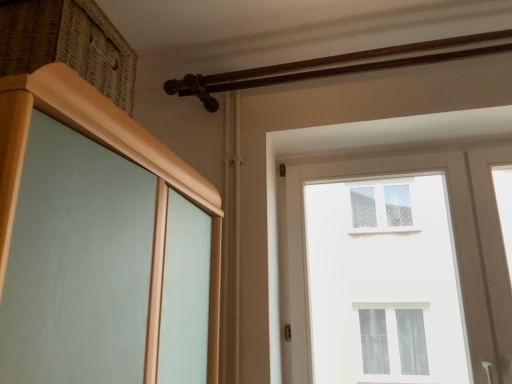
Identify the location of woven wood drawer at upper left. This screenshot has width=512, height=384. (68, 44).

In order to face white glass window at upper center, should I rotate leftwards or rightwards?

To face it directly, rotate right by 20.895 degrees.

Find the location of a particular element. This screenshot has height=384, width=512. woven wood drawer at upper left is located at coordinates (68, 44).

Can you confirm if white glass window at upper center is positioned to the left of woven wood drawer at upper left?

No, white glass window at upper center is not to the left of woven wood drawer at upper left.

From a real-world perspective, relative to woven wood drawer at upper left, is white glass window at upper center vertically above or below?

Clearly, from a real-world perspective, white glass window at upper center is below woven wood drawer at upper left.

Is point (370, 187) positioned in front of point (103, 63)?

No, (370, 187) is behind (103, 63).

Is white glass window at upper center wider or thinner than woven wood drawer at upper left?

Considering their sizes, white glass window at upper center looks slimmer than woven wood drawer at upper left.

How distant is woven wood drawer at upper left from white glass window at upper center?

woven wood drawer at upper left and white glass window at upper center are 2.77 meters apart.

Is point (46, 33) more distant than point (353, 260)?

That is False.

Is woven wood drawer at upper left completely or partially outside of white glass window at upper center?

Absolutely, woven wood drawer at upper left is external to white glass window at upper center.

Which of these two, woven wood drawer at upper left or white glass window at upper center, stands taller?

white glass window at upper center.

Are woven wood drawer at upper left and brown wooden rail at upper center beside each other?

No, woven wood drawer at upper left is not next to brown wooden rail at upper center.

From the image's perspective, is woven wood drawer at upper left located above or below brown wooden rail at upper center?

Based on their image positions, woven wood drawer at upper left is located beneath brown wooden rail at upper center.

Is the position of woven wood drawer at upper left less distant than that of brown wooden rail at upper center?

Yes, woven wood drawer at upper left is closer to the camera.

Which is correct: woven wood drawer at upper left is inside brown wooden rail at upper center, or outside of it?

woven wood drawer at upper left cannot be found inside brown wooden rail at upper center.

Measure the distance from white glass window at upper center to brown wooden rail at upper center.

7.31 feet.

From the image's perspective, which is above, white glass window at upper center or brown wooden rail at upper center?

From the image's view, brown wooden rail at upper center is above.

Would you say white glass window at upper center is outside brown wooden rail at upper center?

Yes, white glass window at upper center is located beyond the bounds of brown wooden rail at upper center.

You are a GUI agent. You are given a task and a screenshot of the screen. Output one action in this format:
    pyautogui.click(x=<x>, y=<y>)
    Task: Click on the window that appears on the right of brown wooden rail at upper center
    The width and height of the screenshot is (512, 384).
    Given the screenshot: What is the action you would take?
    pyautogui.click(x=399, y=270)

Is brown wooden rail at upper center far from woven wood drawer at upper left?

brown wooden rail at upper center is actually quite close to woven wood drawer at upper left.

Is brown wooden rail at upper center facing away from woven wood drawer at upper left?

brown wooden rail at upper center is not turned away from woven wood drawer at upper left.

Is brown wooden rail at upper center to the left of woven wood drawer at upper left from the viewer's perspective?

No, brown wooden rail at upper center is not to the left of woven wood drawer at upper left.

Which of these two, brown wooden rail at upper center or woven wood drawer at upper left, stands taller?

Standing taller between the two is woven wood drawer at upper left.

Considering the relative sizes of brown wooden rail at upper center and white glass window at upper center in the image provided, is brown wooden rail at upper center smaller than white glass window at upper center?

No.

Is brown wooden rail at upper center facing towards white glass window at upper center?

No, brown wooden rail at upper center does not turn towards white glass window at upper center.

Does brown wooden rail at upper center have a greater width compared to white glass window at upper center?

Correct, the width of brown wooden rail at upper center exceeds that of white glass window at upper center.

Considering the sizes of brown wooden rail at upper center and white glass window at upper center in the image, is brown wooden rail at upper center taller or shorter than white glass window at upper center?

In the image, brown wooden rail at upper center appears to be shorter than white glass window at upper center.

Identify the location of drawer that is above the white glass window at upper center (from a real-world perspective). (68, 44).

Where is `drawer above the white glass window at upper center (from the image's perspective)`? This screenshot has width=512, height=384. drawer above the white glass window at upper center (from the image's perspective) is located at coordinates (68, 44).

From the picture: From the image, which object appears to be nearer to woven wood drawer at upper left, brown wooden rail at upper center or white glass window at upper center?

brown wooden rail at upper center.

When comparing their distances from brown wooden rail at upper center, does white glass window at upper center or woven wood drawer at upper left seem closer?

Among the two, woven wood drawer at upper left is located nearer to brown wooden rail at upper center.

When comparing their distances from white glass window at upper center, does woven wood drawer at upper left or brown wooden rail at upper center seem further?

woven wood drawer at upper left is positioned further to the anchor white glass window at upper center.

Based on their spatial positions, is brown wooden rail at upper center or woven wood drawer at upper left closer to white glass window at upper center?

brown wooden rail at upper center is positioned closer to the anchor white glass window at upper center.

From the image, which object appears to be farther from woven wood drawer at upper left, white glass window at upper center or brown wooden rail at upper center?

white glass window at upper center is further to woven wood drawer at upper left.

Which object lies further to the anchor point brown wooden rail at upper center, woven wood drawer at upper left or white glass window at upper center?

white glass window at upper center is positioned further to the anchor brown wooden rail at upper center.

At what (x,y) coordinates should I click in order to perform the action: click on rail between woven wood drawer at upper left and white glass window at upper center. Please return your answer as a coordinate pair (x, y). The image size is (512, 384). Looking at the image, I should click on (338, 65).